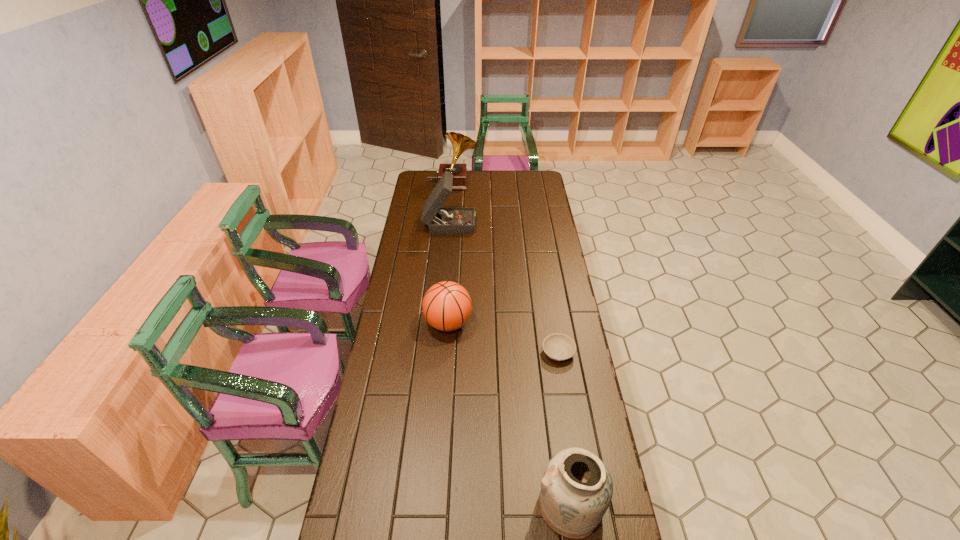
The image size is (960, 540). I want to click on vacant region between the bowl and the second shortest object, so click(503, 338).

Image resolution: width=960 pixels, height=540 pixels. Identify the location of free area in between the shortest object and the basketball. (503, 338).

The height and width of the screenshot is (540, 960). I want to click on object identified as the second closest to the farthest object, so click(x=447, y=306).

Locate an element on the screen. the second closest object relative to the pottery is located at coordinates (447, 306).

You are a GUI agent. You are given a task and a screenshot of the screen. Output one action in this format:
    pyautogui.click(x=<x>, y=<y>)
    Task: Click on the vacant position in the image that satisfies the following two spatial constraints: 1. from the horn of the second shortest object; 2. on the right side of the taller phonograph_record
    
    Given the screenshot: What is the action you would take?
    pyautogui.click(x=441, y=323)

Identify the location of vacant space that satisfies the following two spatial constraints: 1. from the horn of the farther phonograph_record; 2. on the left side of the bowl. (438, 353).

Where is `vacant position in the image that satisfies the following two spatial constraints: 1. from the horn of the farther phonograph_record; 2. on the right side of the bowl`? The width and height of the screenshot is (960, 540). vacant position in the image that satisfies the following two spatial constraints: 1. from the horn of the farther phonograph_record; 2. on the right side of the bowl is located at coordinates (438, 353).

Identify the location of vacant space that satisfies the following two spatial constraints: 1. from the horn of the shortest object; 2. on the right side of the farther phonograph_record. The width and height of the screenshot is (960, 540). (438, 353).

The height and width of the screenshot is (540, 960). I want to click on free point that satisfies the following two spatial constraints: 1. from the horn of the farthest object; 2. on the right side of the basketball, so click(441, 323).

This screenshot has width=960, height=540. I want to click on blank area in the image that satisfies the following two spatial constraints: 1. on the front-facing side of the shortest object; 2. on the right side of the second farthest object, so click(438, 353).